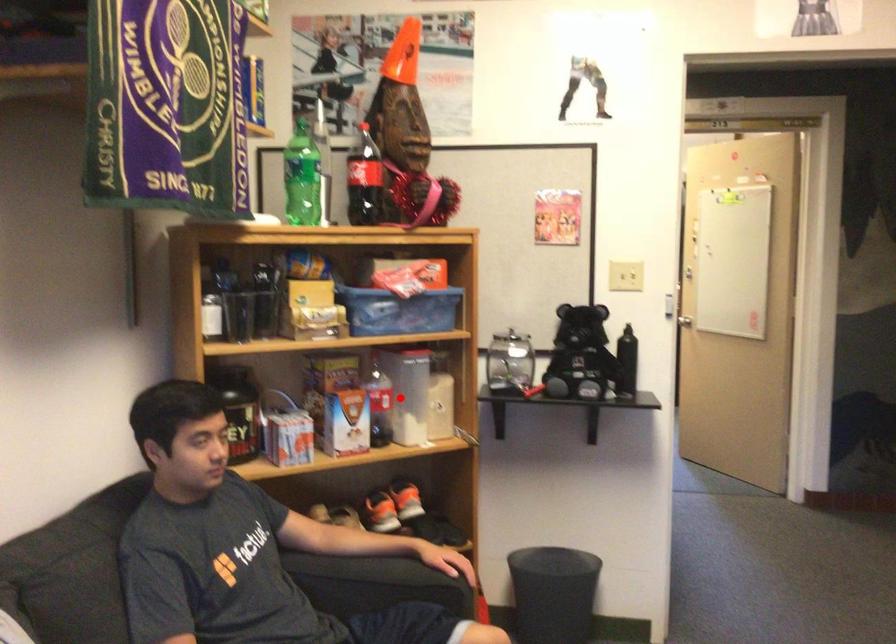
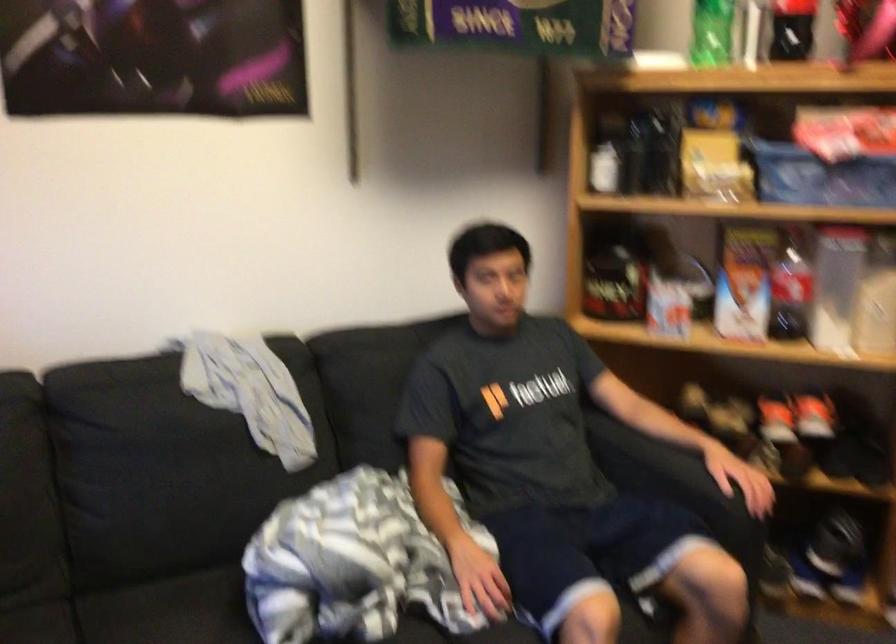
In the second image, find the point that corresponds to the highlighted location in the first image.

(836, 287)